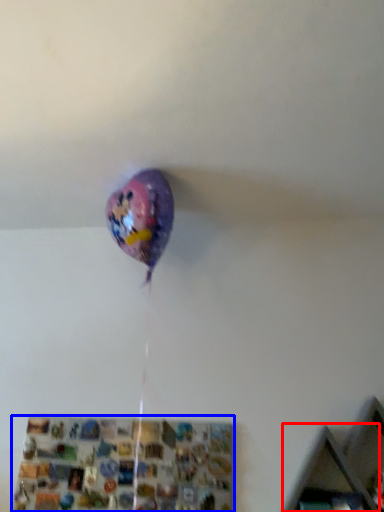
Question: Which of the following is the closest to the observer, shelf (highlighted by a red box) or shelf (highlighted by a blue box)?

Choices:
 (A) shelf
 (B) shelf

Answer: (A)